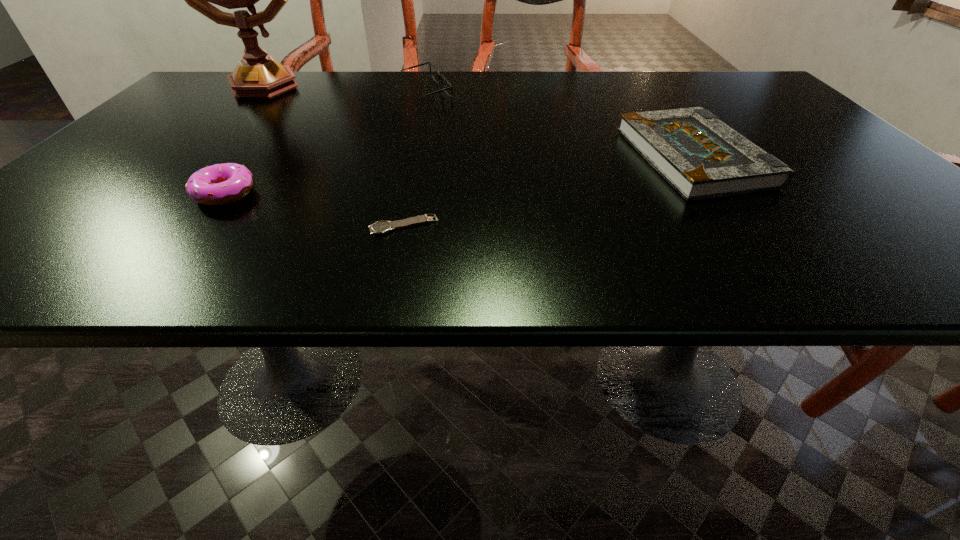
The image size is (960, 540). What are the coordinates of `vacant space at the near left corner of the desktop` in the screenshot? It's located at (12, 248).

The height and width of the screenshot is (540, 960). In order to click on vacant space at the far right corner of the desktop in this screenshot , I will do `click(730, 82)`.

Where is `free spot between the spectacles and the tallest object`? The image size is (960, 540). free spot between the spectacles and the tallest object is located at coordinates (343, 89).

Locate an element on the screen. Image resolution: width=960 pixels, height=540 pixels. free space between the tallest object and the fourth shortest object is located at coordinates (343, 89).

In order to click on free spot between the doughnut and the globe in this screenshot , I will do pyautogui.click(x=242, y=139).

What are the coordinates of `vacant space in between the nearest object and the doughnut` in the screenshot? It's located at [314, 209].

Find the location of a particular element. The image size is (960, 540). empty location between the second tallest object and the watch is located at coordinates (415, 159).

Locate an element on the screen. vacant space that is in between the doughnut and the nearest object is located at coordinates (314, 209).

Where is `free space between the tallest object and the shortest object`? free space between the tallest object and the shortest object is located at coordinates (331, 155).

The width and height of the screenshot is (960, 540). I want to click on free space between the tallest object and the fourth shortest object, so click(x=343, y=89).